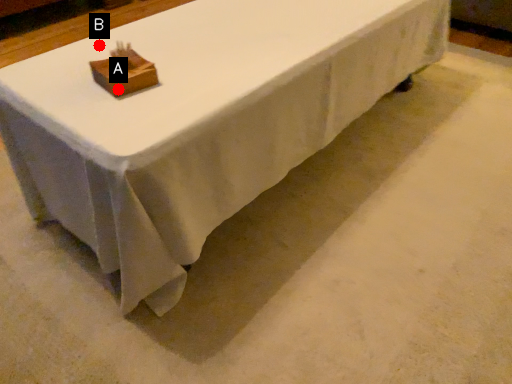
Question: Two points are circled on the image, labeled by A and B beside each circle. Which point appears farthest from the camera in this image?

Choices:
 (A) A is further
 (B) B is further

Answer: (B)